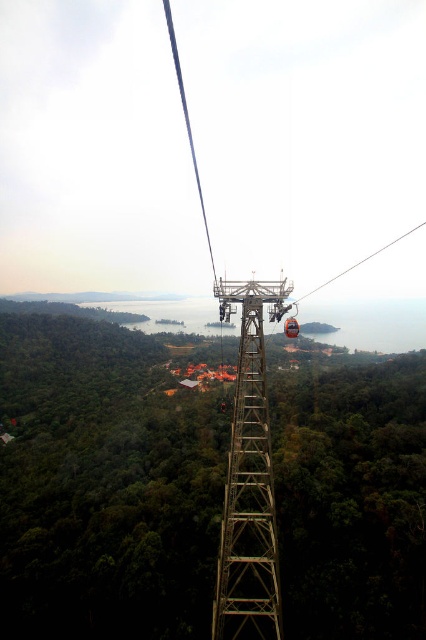
You are a passenger in the metallic cable car at center and want to know if the metallic structure at center is directly underneath you. Based on the scene, can you confirm this?

The metallic structure at center is below the metallic cable car at center, so yes, the metallic structure at center is directly underneath the cable car.

You are a tourist in the cable car and want to take a photo of the metallic structure at center and orange matte ski lift at center. Which one is closer to the bottom of the image?

The metallic structure at center is located below the orange matte ski lift at center, so it is closer to the bottom of the image.

You are a passenger in the metallic cable car at center and want to see the orange matte ski lift at center below you. Can you see it from your current position?

The metallic cable car at center is positioned over the orange matte ski lift at center, so yes, you can see the orange matte ski lift at center from your current position in the metallic cable car at center.